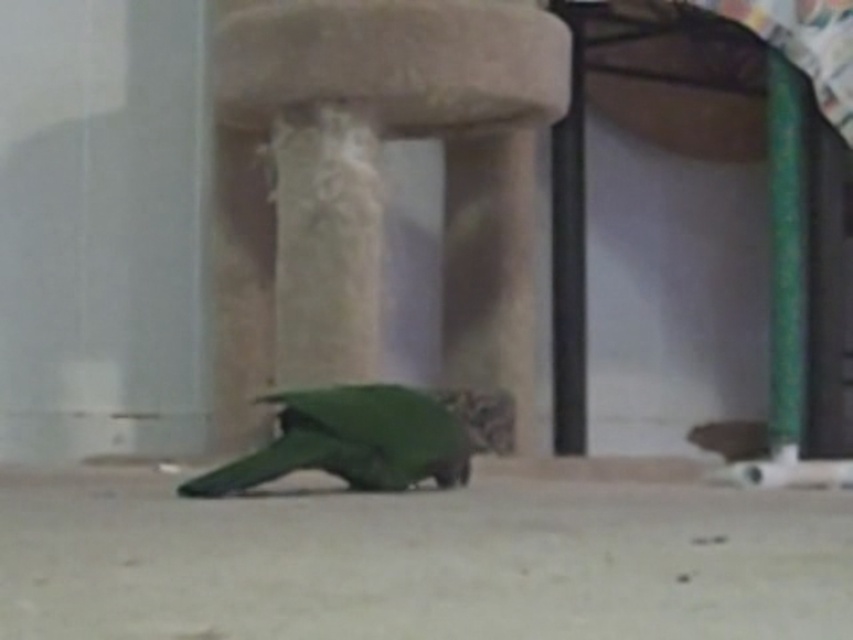
Find the location of a particular element. The height and width of the screenshot is (640, 853). beige textured stool at center is located at coordinates pyautogui.click(x=378, y=184).

Does beige textured stool at center appear on the left side of green matte parrot at center?

Incorrect, beige textured stool at center is not on the left side of green matte parrot at center.

Image resolution: width=853 pixels, height=640 pixels. Describe the element at coordinates (378, 184) in the screenshot. I see `beige textured stool at center` at that location.

You are a GUI agent. You are given a task and a screenshot of the screen. Output one action in this format:
    pyautogui.click(x=<x>, y=<y>)
    Task: Click on the beige textured stool at center
    
    Given the screenshot: What is the action you would take?
    pyautogui.click(x=378, y=184)

Measure the distance between green matte parrot at center and green plastic pole at right.

green matte parrot at center and green plastic pole at right are 2.27 meters apart.

Looking at this image, which is more to the left, green matte parrot at center or green plastic pole at right?

green matte parrot at center

Between point (286, 392) and point (785, 184), which one is positioned behind?

Positioned behind is point (785, 184).

At what (x,y) coordinates should I click in order to perform the action: click on green matte parrot at center. Please return your answer as a coordinate pair (x, y). Image resolution: width=853 pixels, height=640 pixels. Looking at the image, I should click on (352, 440).

Is point (312, 211) farther from camera compared to point (791, 129)?

No.

Based on the photo, does beige textured stool at center appear under green plastic pole at right?

No.

Does point (229, 166) come closer to viewer compared to point (781, 156)?

That is True.

Image resolution: width=853 pixels, height=640 pixels. Identify the location of beige textured stool at center. [378, 184].